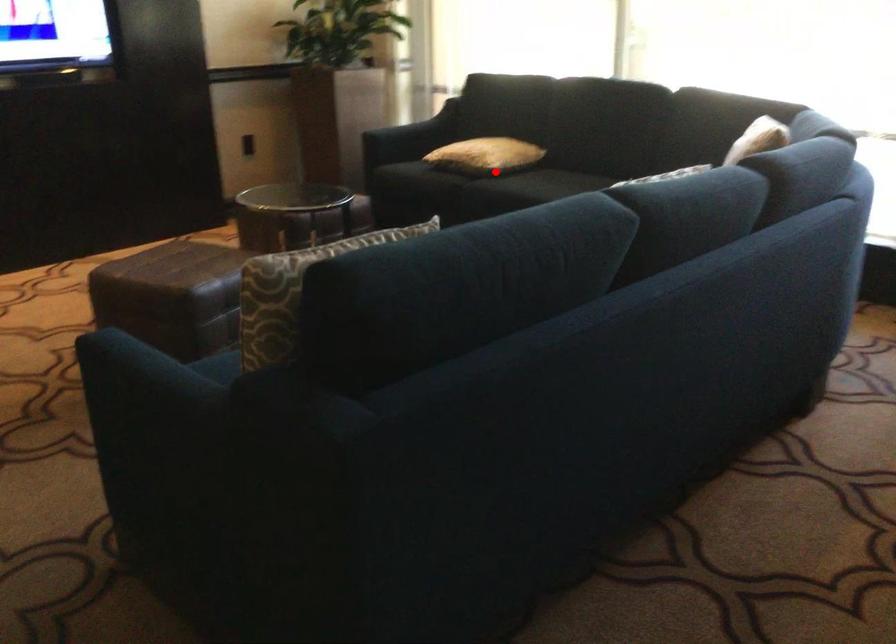
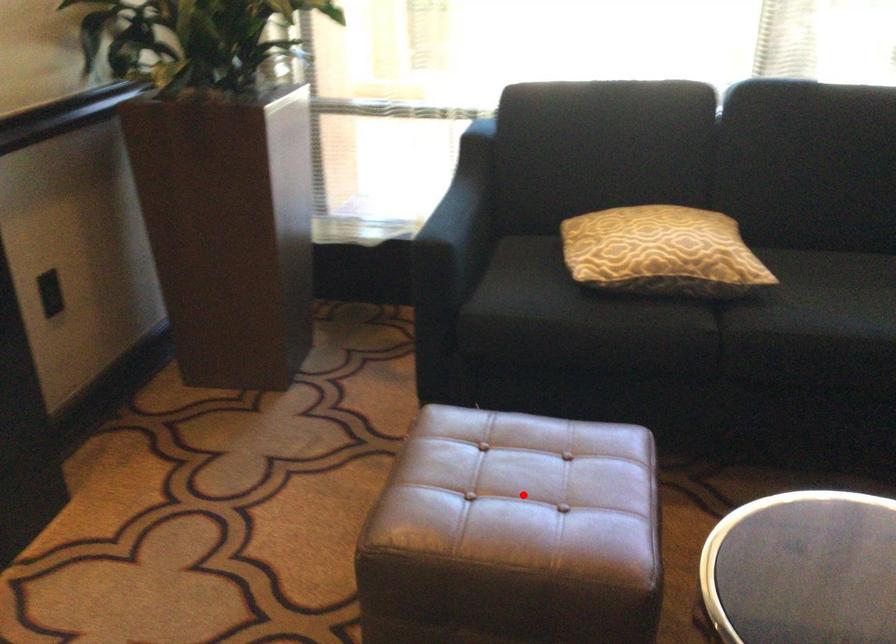
I am providing you with two images of the same scene from different viewpoints. A red point is marked on the first image and another point is marked on the second image. Do the highlighted points in image1 and image2 indicate the same real-world spot?

No